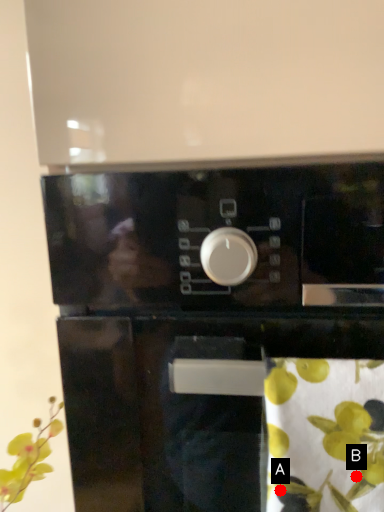
Question: Two points are circled on the image, labeled by A and B beside each circle. Which point appears farthest from the camera in this image?

Choices:
 (A) A is further
 (B) B is further

Answer: (A)